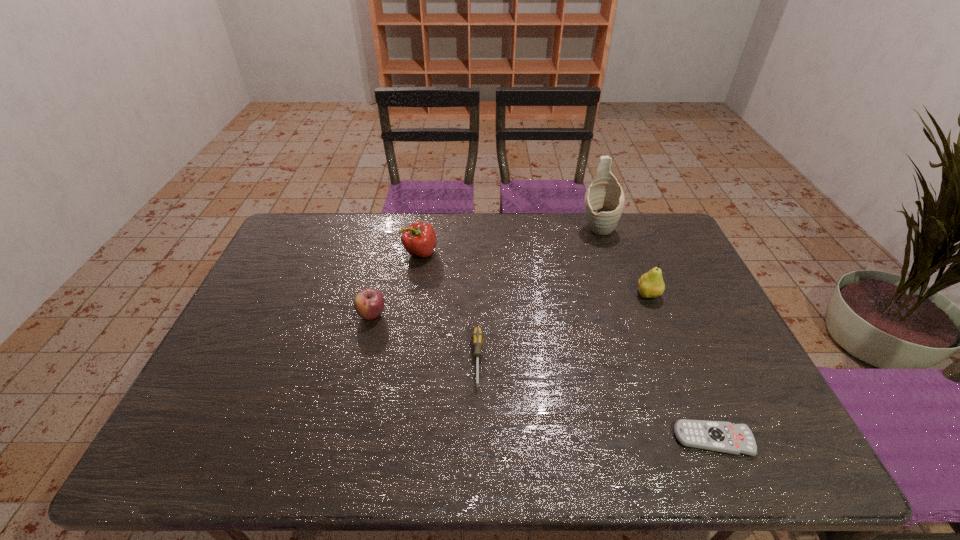
In order to click on the tallest object in this screenshot , I will do `click(604, 200)`.

What are the coordinates of `pitcher` in the screenshot? It's located at (604, 200).

The width and height of the screenshot is (960, 540). I want to click on the third farthest object, so click(x=651, y=284).

Locate an element on the screen. The height and width of the screenshot is (540, 960). the second farthest object is located at coordinates (419, 239).

Identify the location of pepper. The image size is (960, 540). (419, 239).

The width and height of the screenshot is (960, 540). Find the location of `the leftmost object`. the leftmost object is located at coordinates (369, 303).

This screenshot has height=540, width=960. In order to click on the third nearest object in this screenshot , I will do `click(369, 303)`.

Find the location of a particular element. The height and width of the screenshot is (540, 960). the second nearest object is located at coordinates tap(477, 337).

Image resolution: width=960 pixels, height=540 pixels. Identify the location of the second shortest object. [477, 337].

Where is `the nearest object`? the nearest object is located at coordinates (718, 436).